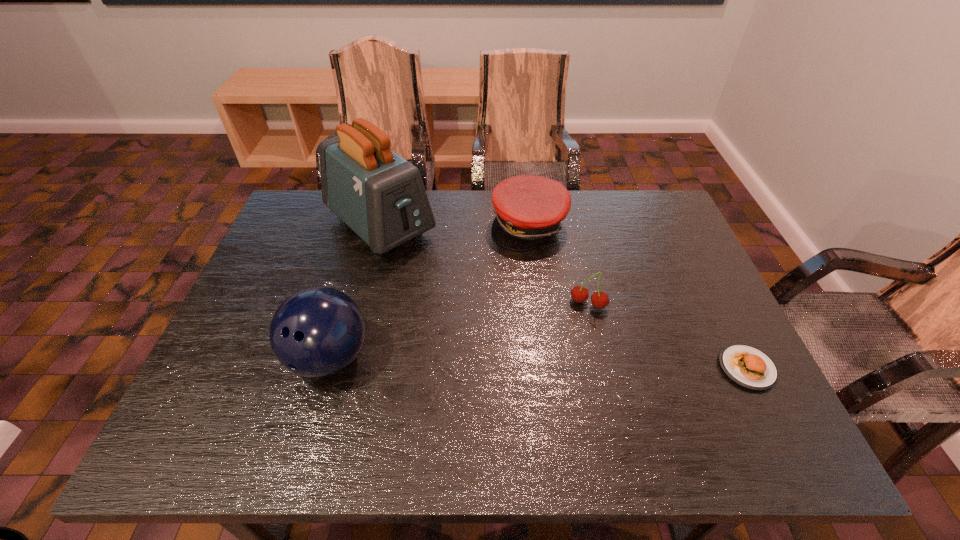
I want to click on free space on the desktop that is between the second tallest object and the food and is positioned on the front-facing side of the toaster, so click(x=538, y=363).

Where is `vacant space on the desktop that is between the fourth shortest object and the shortest object and is positioned on the surface of the cherry`? The image size is (960, 540). vacant space on the desktop that is between the fourth shortest object and the shortest object and is positioned on the surface of the cherry is located at coordinates (564, 363).

Locate an element on the screen. free spot on the desktop that is between the bowling ball and the rightmost object and is positioned on the front-facing side of the cap is located at coordinates (593, 364).